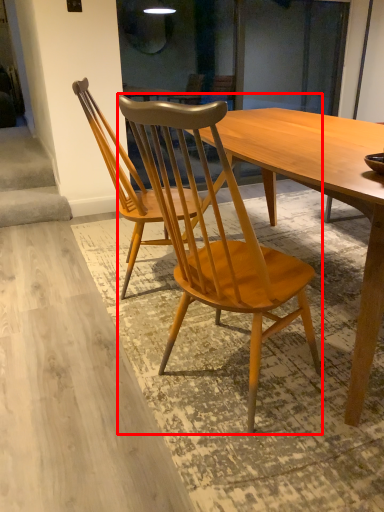
Question: From the image's perspective, where is chair (annotated by the red box) located in relation to chair in the image?

Choices:
 (A) below
 (B) above

Answer: (A)